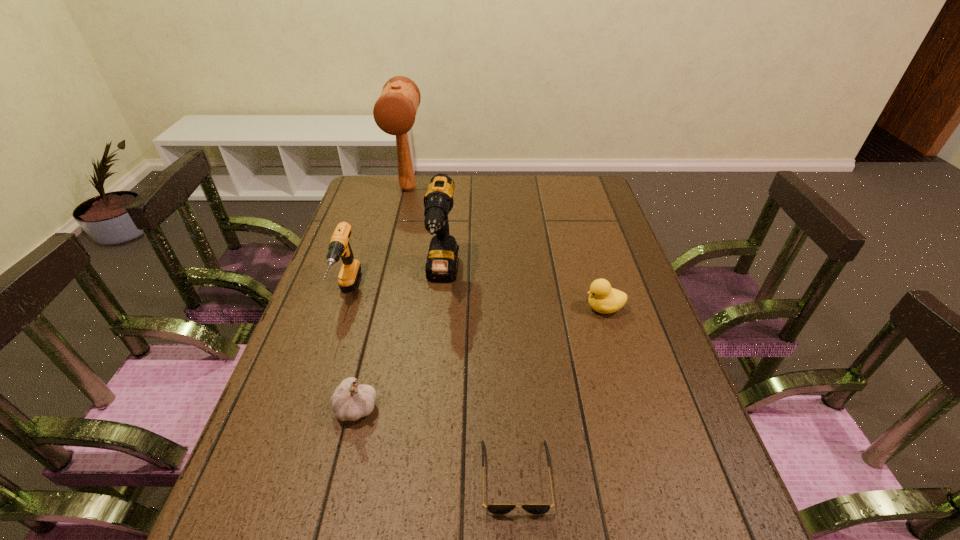
I want to click on mallet that is positioned at the left edge, so click(x=394, y=112).

Image resolution: width=960 pixels, height=540 pixels. I want to click on drill situated at the left edge, so click(x=339, y=246).

You are a GUI agent. You are given a task and a screenshot of the screen. Output one action in this format:
    pyautogui.click(x=<x>, y=<y>)
    Task: Click on the garlic that is at the left edge
    Image resolution: width=960 pixels, height=540 pixels.
    Given the screenshot: What is the action you would take?
    pyautogui.click(x=350, y=401)

This screenshot has height=540, width=960. Identify the location of object present at the right edge. (602, 298).

Find the location of a particular element. object that is at the far left corner is located at coordinates (394, 112).

The height and width of the screenshot is (540, 960). In the image, there is a desktop. Find the location of `free space at the far edge`. free space at the far edge is located at coordinates (506, 205).

This screenshot has width=960, height=540. I want to click on free space at the left edge of the desktop, so click(307, 502).

What are the coordinates of `blank space at the right edge of the desktop` in the screenshot? It's located at (642, 346).

You are a GUI agent. You are given a task and a screenshot of the screen. Output one action in this format:
    pyautogui.click(x=<x>, y=<y>)
    Task: Click on the vacant space at the far left corner of the desktop
    The image size is (960, 540).
    Given the screenshot: What is the action you would take?
    pyautogui.click(x=365, y=204)

Where is `vacant space at the far right corner of the desktop`? The image size is (960, 540). vacant space at the far right corner of the desktop is located at coordinates (574, 205).